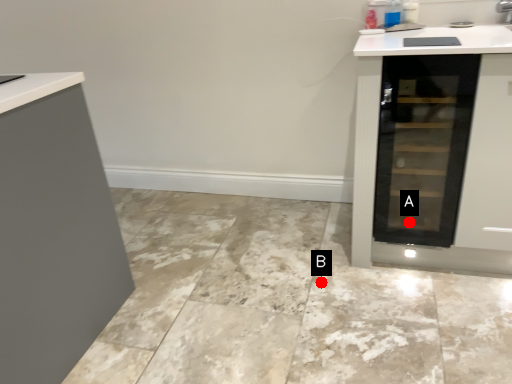
Question: Two points are circled on the image, labeled by A and B beside each circle. Which point appears closest to the camera in this image?

Choices:
 (A) A is closer
 (B) B is closer

Answer: (B)